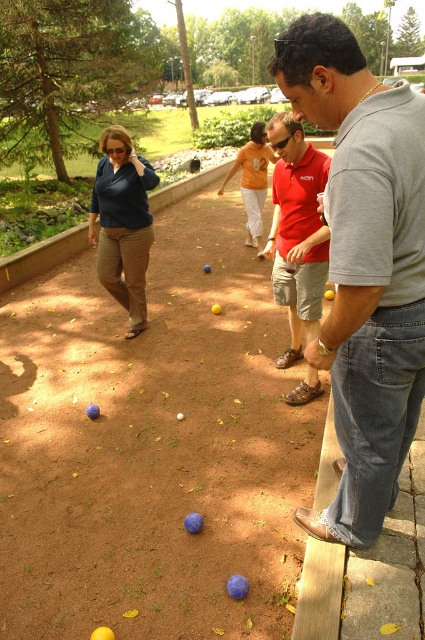
Question: Which of the following is the farthest from the observer?

Choices:
 (A) [246, 188]
 (B) [402, 316]

Answer: (A)

Question: Which of the following is the farthest from the observer?

Choices:
 (A) (303, 230)
 (B) (265, 134)
 (C) (317, 362)

Answer: (B)

Question: Considering the relative positions of gray cotton shirt at center and matte red polo shirt at center in the image provided, where is gray cotton shirt at center located with respect to matte red polo shirt at center?

Choices:
 (A) left
 (B) right

Answer: (A)

Question: Which of the following is the closest to the observer?

Choices:
 (A) gray cotton shirt at center
 (B) matte red polo shirt at center

Answer: (A)

Question: In this image, where is gray cotton shirt at center located relative to orange cotton shirt at center?

Choices:
 (A) above
 (B) below

Answer: (B)

Question: Is matte red polo shirt at center below orange cotton shirt at center?

Choices:
 (A) no
 (B) yes

Answer: (B)